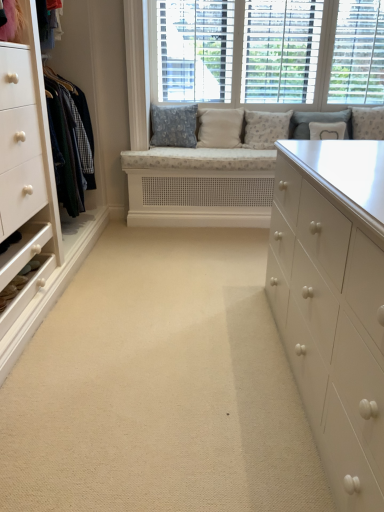
Describe the element at coordinates (368, 123) in the screenshot. The width and height of the screenshot is (384, 512). I see `fluffy white pillow at upper right, which is the 6th pillow from left to right` at that location.

What do you see at coordinates (173, 126) in the screenshot? I see `textured blue pillow at center, which ranks as the 6th pillow in right-to-left order` at bounding box center [173, 126].

Locate an element on the screen. The height and width of the screenshot is (512, 384). patterned fabric pillow at center, which is the third pillow in left-to-right order is located at coordinates (265, 128).

I want to click on white fabric pillow at upper center, which ranks as the second pillow in right-to-left order, so click(327, 130).

What are the coordinates of `white textured cushions at upper center` in the screenshot? It's located at tap(309, 54).

The width and height of the screenshot is (384, 512). In order to click on fluffy white pillow at upper right, which is the 6th pillow from left to right in this screenshot , I will do `click(368, 123)`.

From the picture: Is patterned fabric pillow at center, which is the third pillow in left-to-right order, positioned with its back to beige fabric pillow at center, which is counted as the fifth pillow, starting from the right?

No, beige fabric pillow at center, which is counted as the fifth pillow, starting from the right, is not at the back of patterned fabric pillow at center, which is the third pillow in left-to-right order.

In terms of size, does patterned fabric pillow at center, which is the third pillow in left-to-right order, appear bigger or smaller than beige fabric pillow at center, which ranks as the second pillow in left-to-right order?

In the image, patterned fabric pillow at center, which is the third pillow in left-to-right order, appears to be larger than beige fabric pillow at center, which ranks as the second pillow in left-to-right order.

What's the angular difference between patterned fabric pillow at center, the 4th pillow in the right-to-left sequence, and beige fabric pillow at center, which is counted as the fifth pillow, starting from the right,'s facing directions?

The angle between the facing direction of patterned fabric pillow at center, the 4th pillow in the right-to-left sequence, and the facing direction of beige fabric pillow at center, which is counted as the fifth pillow, starting from the right, is 1.83 degrees.

Between white textured pillow at upper center, the fourth pillow positioned from the left, and beige fabric pillow at center, which is counted as the fifth pillow, starting from the right, which one appears on the left side from the viewer's perspective?

From the viewer's perspective, beige fabric pillow at center, which is counted as the fifth pillow, starting from the right, appears more on the left side.

Is white textured pillow at upper center, placed as the third pillow when sorted from right to left, directly adjacent to beige fabric pillow at center, which is counted as the fifth pillow, starting from the right?

No.

Which point is more forward, (349, 125) or (219, 136)?

The point (349, 125) is closer to the camera.

Between white textured pillow at upper center, placed as the third pillow when sorted from right to left, and beige fabric pillow at center, which is counted as the fifth pillow, starting from the right, which one is positioned in front?

white textured pillow at upper center, placed as the third pillow when sorted from right to left, is more forward.

Based on the photo, from a real-world perspective, is beige carpet at center positioned above or below fluffy white pillow at upper right, which is the 6th pillow from left to right?

Clearly, from a real-world perspective, beige carpet at center is below fluffy white pillow at upper right, which is the 6th pillow from left to right.

Which is behind, point (192, 252) or point (373, 111)?

The point (373, 111) is farther from the camera.

Is fluffy white pillow at upper right, the 1th pillow from the right, at the back of beige carpet at center?

That's not correct — beige carpet at center is not looking away from fluffy white pillow at upper right, the 1th pillow from the right.

Does beige carpet at center lie in front of textured blue pillow at center, the first pillow positioned from the left?

That is True.

From the image's perspective, is beige carpet at center under textured blue pillow at center, which ranks as the 6th pillow in right-to-left order?

Indeed, from the image's perspective, beige carpet at center is shown beneath textured blue pillow at center, which ranks as the 6th pillow in right-to-left order.

Is beige carpet at center oriented towards textured blue pillow at center, which ranks as the 6th pillow in right-to-left order?

No, beige carpet at center is not oriented towards textured blue pillow at center, which ranks as the 6th pillow in right-to-left order.

Considering the sizes of objects beige carpet at center and textured blue pillow at center, the first pillow positioned from the left, in the image provided, who is bigger, beige carpet at center or textured blue pillow at center, the first pillow positioned from the left,?

beige carpet at center.

From the image's perspective, is fluffy white pillow at upper right, which is the 6th pillow from left to right, above or below beige fabric pillow at center, which is counted as the fifth pillow, starting from the right?

From the image's perspective, fluffy white pillow at upper right, which is the 6th pillow from left to right, appears above beige fabric pillow at center, which is counted as the fifth pillow, starting from the right.

Is fluffy white pillow at upper right, which is the 6th pillow from left to right, thinner than beige fabric pillow at center, which is counted as the fifth pillow, starting from the right?

Yes.

Considering the sizes of objects fluffy white pillow at upper right, which is the 6th pillow from left to right, and beige fabric pillow at center, which ranks as the second pillow in left-to-right order, in the image provided, who is bigger, fluffy white pillow at upper right, which is the 6th pillow from left to right, or beige fabric pillow at center, which ranks as the second pillow in left-to-right order,?

Bigger between the two is beige fabric pillow at center, which ranks as the second pillow in left-to-right order.

Are fluffy white pillow at upper right, the 1th pillow from the right, and beige fabric pillow at center, which is counted as the fifth pillow, starting from the right, making contact?

No, fluffy white pillow at upper right, the 1th pillow from the right, is not making contact with beige fabric pillow at center, which is counted as the fifth pillow, starting from the right.

Which object is positioned more to the right, white textured cushions at upper center or fluffy white pillow at upper right, the 1th pillow from the right?

From the viewer's perspective, fluffy white pillow at upper right, the 1th pillow from the right, appears more on the right side.

Can you confirm if white textured cushions at upper center is shorter than fluffy white pillow at upper right, which is the 6th pillow from left to right?

In fact, white textured cushions at upper center may be taller than fluffy white pillow at upper right, which is the 6th pillow from left to right.

Would you say white textured cushions at upper center is inside or outside fluffy white pillow at upper right, which is the 6th pillow from left to right?

The correct answer is: outside.

Which of these two, white textured cushions at upper center or fluffy white pillow at upper right, which is the 6th pillow from left to right, is smaller?

With smaller size is fluffy white pillow at upper right, which is the 6th pillow from left to right.

Is point (368, 135) farther from camera compared to point (291, 138)?

Yes.

Who is shorter, fluffy white pillow at upper right, which is the 6th pillow from left to right, or white textured pillow at upper center, the fourth pillow positioned from the left?

With less height is white textured pillow at upper center, the fourth pillow positioned from the left.

From a real-world perspective, which is physically below, fluffy white pillow at upper right, which is the 6th pillow from left to right, or white textured pillow at upper center, the fourth pillow positioned from the left?

white textured pillow at upper center, the fourth pillow positioned from the left, is physically lower.

Starting from the patterned fabric pillow at center, the 4th pillow in the right-to-left sequence, which pillow is the 1st one to the left? Please provide its 2D coordinates.

[(220, 128)]

From a real-world perspective, which pillow is the 3rd one underneath the white textured pillow at upper center, placed as the third pillow when sorted from right to left? Please provide its 2D coordinates.

[(220, 128)]

Looking at the image, which one is located further to white textured cushions at upper center, beige fabric pillow at center, which is counted as the fifth pillow, starting from the right, or fluffy white pillow at upper right, the 1th pillow from the right?

beige fabric pillow at center, which is counted as the fifth pillow, starting from the right.

Which object lies nearer to the anchor point textured blue pillow at center, the first pillow positioned from the left, beige fabric pillow at center, which ranks as the second pillow in left-to-right order, or beige carpet at center?

beige fabric pillow at center, which ranks as the second pillow in left-to-right order, lies closer to textured blue pillow at center, the first pillow positioned from the left, than the other object.

Estimate the real-world distances between objects in this image. Which object is closer to beige fabric pillow at center, which ranks as the second pillow in left-to-right order, white fabric pillow at upper center, which ranks as the second pillow in right-to-left order, or white textured cushions at upper center?

white textured cushions at upper center lies closer to beige fabric pillow at center, which ranks as the second pillow in left-to-right order, than the other object.

When comparing their distances from beige carpet at center, does white textured cushions at upper center or patterned fabric pillow at center, which is the third pillow in left-to-right order, seem further?

white textured cushions at upper center.

Considering their positions, is white textured pillow at upper center, the fourth pillow positioned from the left, positioned closer to beige carpet at center than beige fabric pillow at center, which is counted as the fifth pillow, starting from the right?

beige fabric pillow at center, which is counted as the fifth pillow, starting from the right, lies closer to beige carpet at center than the other object.

Estimate the real-world distances between objects in this image. Which object is closer to white textured pillow at upper center, the fourth pillow positioned from the left, beige carpet at center or white textured cushions at upper center?

white textured cushions at upper center.

From the image, which object appears to be farther from white textured cushions at upper center, fluffy white pillow at upper right, which is the 6th pillow from left to right, or patterned fabric pillow at center, the 4th pillow in the right-to-left sequence?

Based on the image, fluffy white pillow at upper right, which is the 6th pillow from left to right, appears to be further to white textured cushions at upper center.

Looking at the image, which one is located further to textured blue pillow at center, which ranks as the 6th pillow in right-to-left order, white fabric pillow at upper center, the 5th pillow in the left-to-right sequence, or fluffy white pillow at upper right, the 1th pillow from the right?

fluffy white pillow at upper right, the 1th pillow from the right.

I want to click on window between beige carpet at center and fluffy white pillow at upper right, which is the 6th pillow from left to right, in the front-back direction, so click(309, 54).

Where is `pillow between textured blue pillow at center, which ranks as the 6th pillow in right-to-left order, and white textured cushions at upper center from left to right`? This screenshot has width=384, height=512. pillow between textured blue pillow at center, which ranks as the 6th pillow in right-to-left order, and white textured cushions at upper center from left to right is located at coordinates (220, 128).

Where is `pillow located between patterned fabric pillow at center, which is the third pillow in left-to-right order, and white fabric pillow at upper center, the 5th pillow in the left-to-right sequence, in the left-right direction`? Image resolution: width=384 pixels, height=512 pixels. pillow located between patterned fabric pillow at center, which is the third pillow in left-to-right order, and white fabric pillow at upper center, the 5th pillow in the left-to-right sequence, in the left-right direction is located at coordinates (318, 121).

The height and width of the screenshot is (512, 384). Find the location of `window positioned between beige carpet at center and white fabric pillow at upper center, the 5th pillow in the left-to-right sequence, from near to far`. window positioned between beige carpet at center and white fabric pillow at upper center, the 5th pillow in the left-to-right sequence, from near to far is located at coordinates (309, 54).